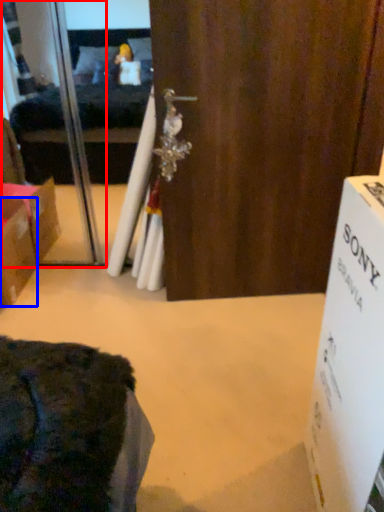
Question: Which point is further to the camera, screen door (highlighted by a red box) or box (highlighted by a blue box)?

Choices:
 (A) screen door
 (B) box

Answer: (A)